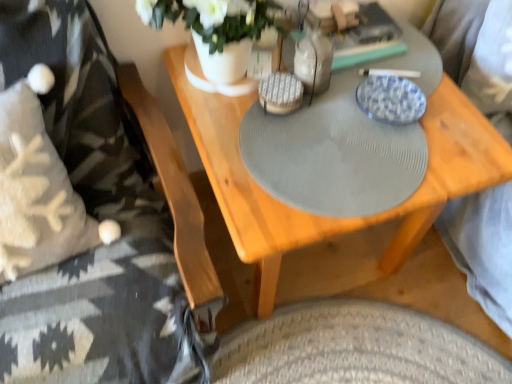
You are a GUI agent. You are given a task and a screenshot of the screen. Output one action in this format:
    pyautogui.click(x=<x>, y=<y>)
    Task: Click on the free space in front of clear glass bottle at center
    The image size is (512, 384).
    Given the screenshot: What is the action you would take?
    pyautogui.click(x=320, y=143)